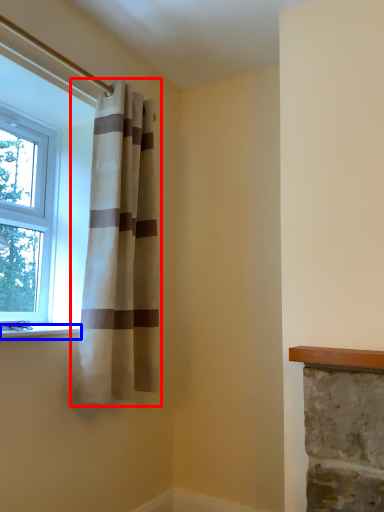
Question: Which object is further to the camera taking this photo, curtain (highlighted by a red box) or window sill (highlighted by a blue box)?

Choices:
 (A) curtain
 (B) window sill

Answer: (A)